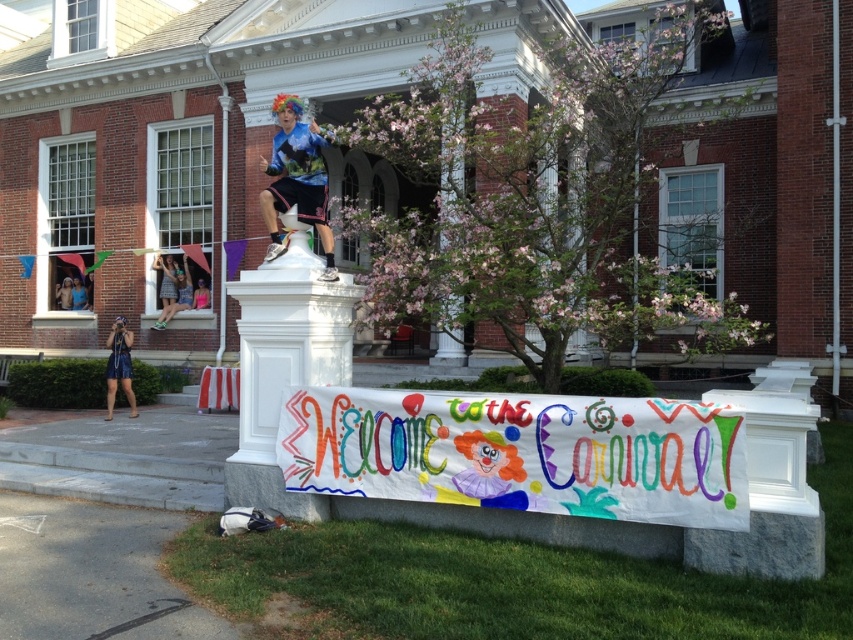
In the scene shown: Can you confirm if matte blue shirt at center is positioned to the right of shiny silver helmet at upper center?

Correct, you'll find matte blue shirt at center to the right of shiny silver helmet at upper center.

Who is positioned more to the right, matte blue shirt at center or shiny silver helmet at upper center?

matte blue shirt at center is more to the right.

Who is more forward, [297,164] or [67,276]?

Point [297,164]

The height and width of the screenshot is (640, 853). In order to click on matte blue shirt at center in this screenshot , I will do `click(296, 179)`.

Between matte blue shirt at center and blue denim shorts at center, which one is positioned lower?

Positioned lower is blue denim shorts at center.

Is matte blue shirt at center to the left of blue denim shorts at center from the viewer's perspective?

In fact, matte blue shirt at center is to the right of blue denim shorts at center.

Locate an element on the screen. The width and height of the screenshot is (853, 640). matte blue shirt at center is located at coordinates (296, 179).

Can you confirm if blue denim shorts at center is wider than shiny silver helmet at upper center?

Correct, the width of blue denim shorts at center exceeds that of shiny silver helmet at upper center.

Measure the distance between blue denim shorts at center and shiny silver helmet at upper center.

They are 20.54 centimeters apart.

Is point (82, 291) positioned after point (64, 305)?

No, it is in front of (64, 305).

Locate an element on the screen. blue denim shorts at center is located at coordinates (79, 294).